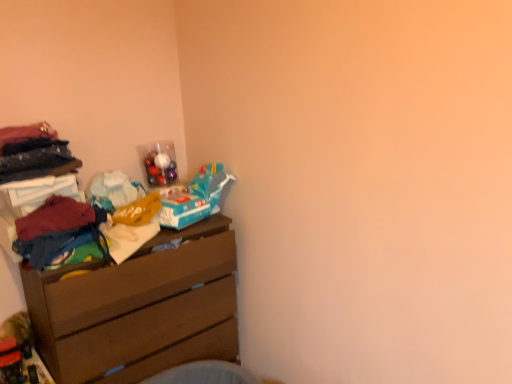
Question: From the image's perspective, is multicolored fabric at left located above brown wooden chest of drawers at left?

Choices:
 (A) no
 (B) yes

Answer: (B)

Question: From a real-world perspective, is multicolored fabric at left located higher than brown wooden chest of drawers at left?

Choices:
 (A) yes
 (B) no

Answer: (A)

Question: Is multicolored fabric at left smaller than brown wooden chest of drawers at left?

Choices:
 (A) yes
 (B) no

Answer: (A)

Question: Considering the relative positions of multicolored fabric at left and brown wooden chest of drawers at left in the image provided, is multicolored fabric at left to the left of brown wooden chest of drawers at left from the viewer's perspective?

Choices:
 (A) yes
 (B) no

Answer: (A)

Question: Is the depth of multicolored fabric at left greater than that of brown wooden chest of drawers at left?

Choices:
 (A) no
 (B) yes

Answer: (A)

Question: Are multicolored fabric at left and brown wooden chest of drawers at left located far from each other?

Choices:
 (A) no
 (B) yes

Answer: (A)

Question: Is brown wooden chest of drawers at left placed right next to multicolored fabric at left?

Choices:
 (A) yes
 (B) no

Answer: (B)

Question: From the image's perspective, does brown wooden chest of drawers at left appear higher than multicolored fabric at left?

Choices:
 (A) no
 (B) yes

Answer: (A)

Question: Is brown wooden chest of drawers at left to the left of multicolored fabric at left from the viewer's perspective?

Choices:
 (A) yes
 (B) no

Answer: (B)

Question: Would you say brown wooden chest of drawers at left contains multicolored fabric at left?

Choices:
 (A) no
 (B) yes

Answer: (A)

Question: From a real-world perspective, is brown wooden chest of drawers at left under multicolored fabric at left?

Choices:
 (A) yes
 (B) no

Answer: (A)

Question: Does brown wooden chest of drawers at left have a smaller size compared to multicolored fabric at left?

Choices:
 (A) no
 (B) yes

Answer: (A)

Question: In terms of height, does multicolored fabric at left look taller or shorter compared to brown wooden chest of drawers at left?

Choices:
 (A) short
 (B) tall

Answer: (A)